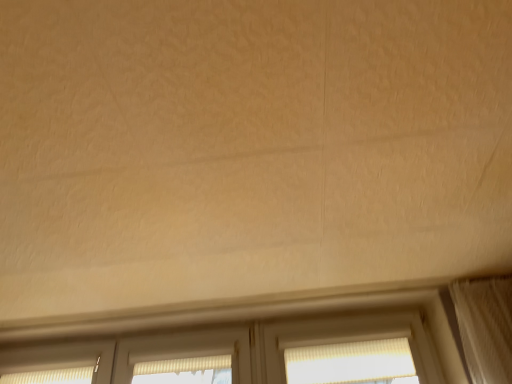
Question: From the image's perspective, is beige textured screen door at center above white textured window at center?

Choices:
 (A) yes
 (B) no

Answer: (B)

Question: Is beige textured screen door at center thinner than white textured window at center?

Choices:
 (A) yes
 (B) no

Answer: (A)

Question: Can you confirm if beige textured screen door at center is wider than white textured window at center?

Choices:
 (A) no
 (B) yes

Answer: (A)

Question: From a real-world perspective, is beige textured screen door at center below white textured window at center?

Choices:
 (A) no
 (B) yes

Answer: (A)

Question: Is beige textured screen door at center behind white textured window at center?

Choices:
 (A) yes
 (B) no

Answer: (A)

Question: Can you confirm if beige textured screen door at center is positioned to the left of white textured window at center?

Choices:
 (A) no
 (B) yes

Answer: (B)

Question: Considering the relative sizes of white textured window at center and beige textured screen door at center in the image provided, is white textured window at center smaller than beige textured screen door at center?

Choices:
 (A) yes
 (B) no

Answer: (B)

Question: From the image's perspective, is white textured window at center located beneath beige textured screen door at center?

Choices:
 (A) yes
 (B) no

Answer: (B)

Question: Is white textured window at center to the right of beige textured screen door at center from the viewer's perspective?

Choices:
 (A) no
 (B) yes

Answer: (B)

Question: Is white textured window at center outside of beige textured screen door at center?

Choices:
 (A) yes
 (B) no

Answer: (A)

Question: Is white textured window at center with beige textured screen door at center?

Choices:
 (A) yes
 (B) no

Answer: (B)

Question: From the image's perspective, is white textured window at center on beige textured screen door at center?

Choices:
 (A) no
 (B) yes

Answer: (B)

Question: From a real-world perspective, is white textured window at center positioned above or below beige textured screen door at center?

Choices:
 (A) above
 (B) below

Answer: (B)